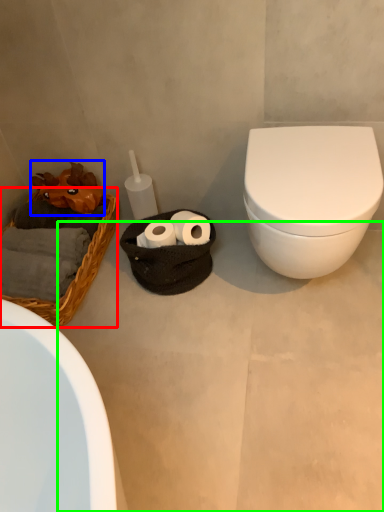
Question: Considering the real-world distances, which object is farthest from basket (highlighted by a red box)? chiffonier (highlighted by a blue box) or concrete (highlighted by a green box)?

Choices:
 (A) chiffonier
 (B) concrete

Answer: (B)